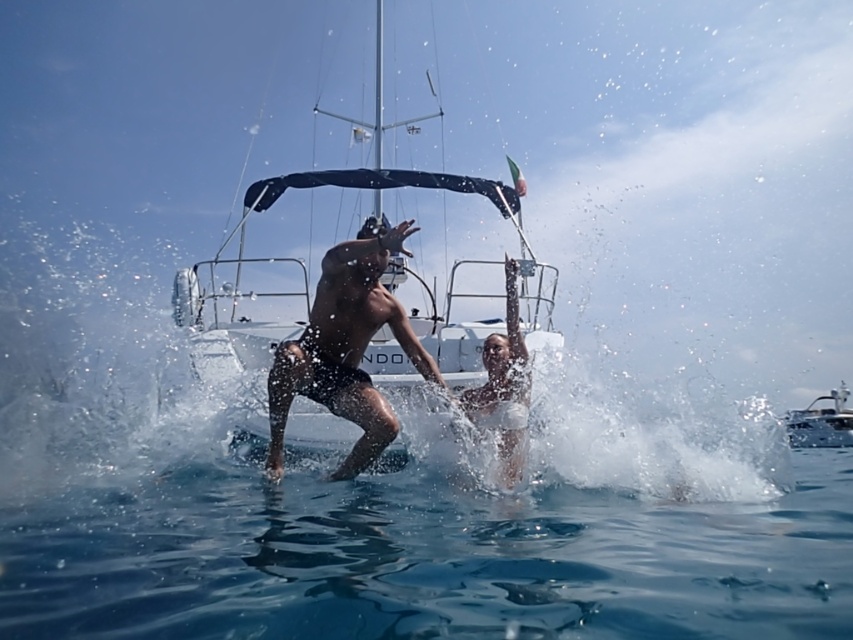
Question: Is brown matte skin at center below white glossy boat at center?

Choices:
 (A) yes
 (B) no

Answer: (B)

Question: Which object is closer to the camera taking this photo?

Choices:
 (A) brown matte skin at center
 (B) white glossy boat at center

Answer: (A)

Question: Which object is the closest to the brown matte skin at center?

Choices:
 (A) white glossy boat at center
 (B) white matte bikini at center

Answer: (B)

Question: In this image, where is brown matte skin at center located relative to white glossy boat at center?

Choices:
 (A) right
 (B) left

Answer: (B)

Question: Does white matte boat at center have a lesser width compared to white glossy boat at center?

Choices:
 (A) no
 (B) yes

Answer: (B)

Question: Which object appears closest to the camera in this image?

Choices:
 (A) white glossy boat at center
 (B) white matte bikini at center

Answer: (B)